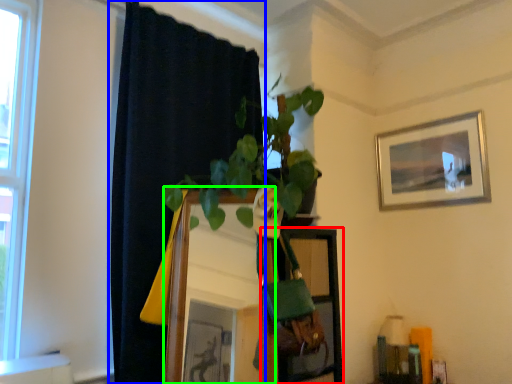
Question: Which object is positioned closest to shelf (highlighted by a red box)? Select from curtain (highlighted by a blue box) and mirror (highlighted by a green box).

Choices:
 (A) curtain
 (B) mirror

Answer: (B)